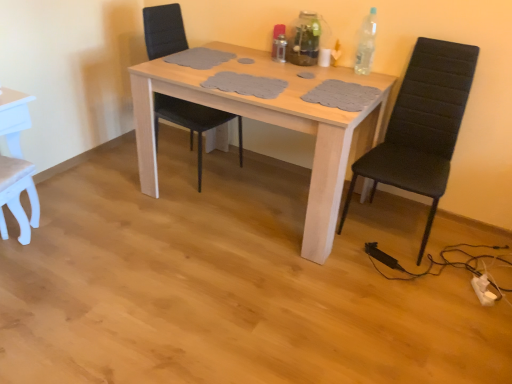
Identify the location of vacant area that lies between white matte chair at lower left, which is the third chair in right-to-left order, and black fabric chair at right, marked as the 3th chair in a left-to-right arrangement. (184, 250).